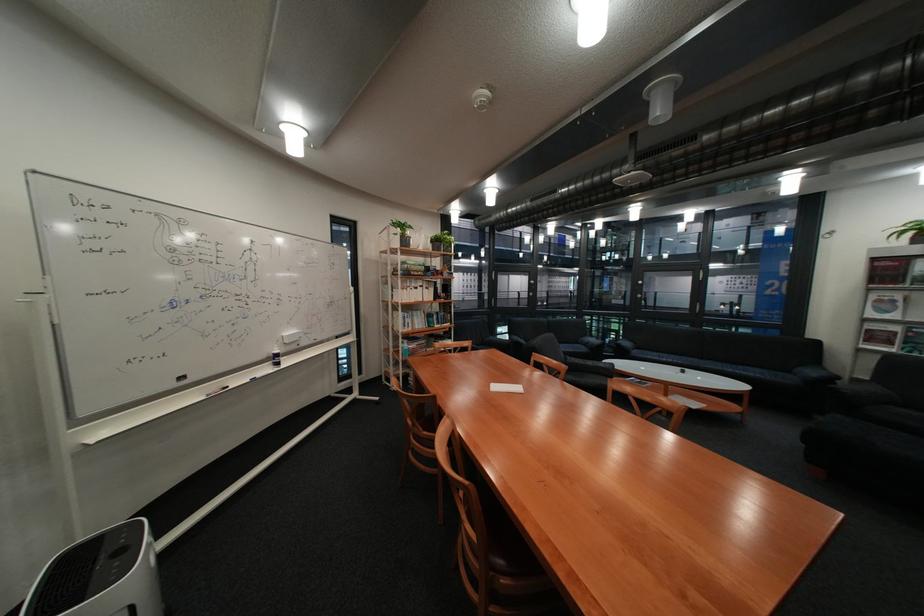
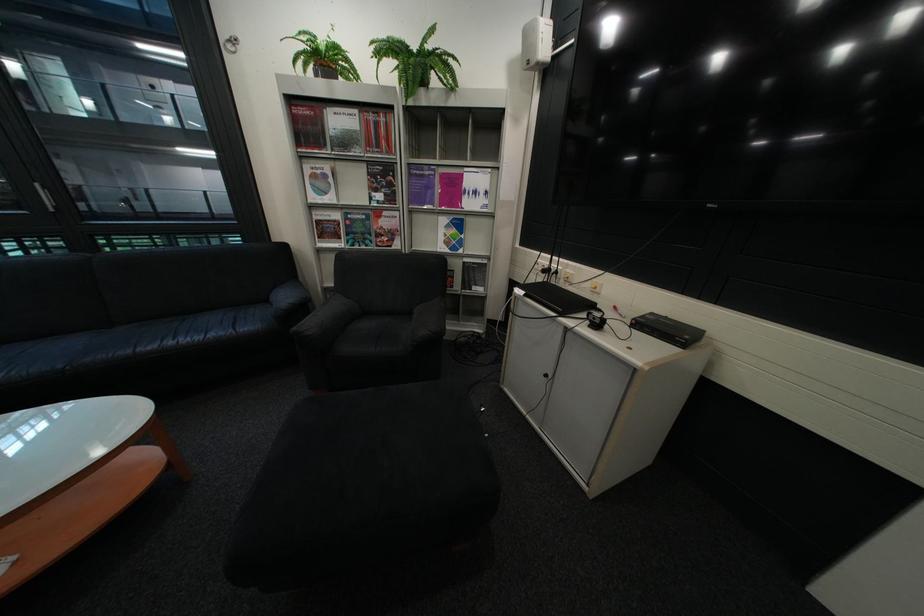
The point at (894, 301) is marked in the first image. Where is the corresponding point in the second image?

(329, 177)